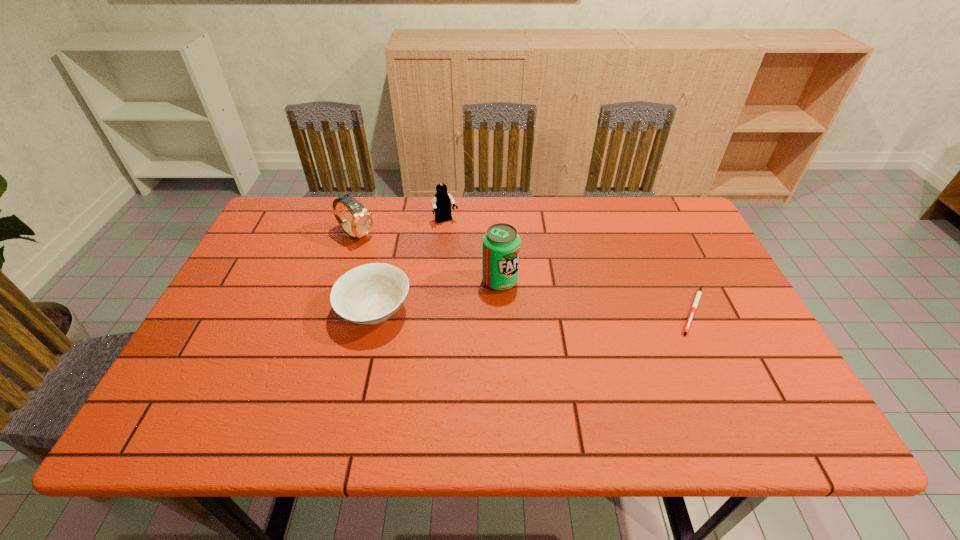
You are a GUI agent. You are given a task and a screenshot of the screen. Output one action in this format:
    pyautogui.click(x=<x>, y=<y>)
    Task: Click on the vacant space on the desktop that is between the bowl and the shortest object and is positioned on the front-facing side of the pop soda
    
    Given the screenshot: What is the action you would take?
    pyautogui.click(x=572, y=311)

The image size is (960, 540). What are the coordinates of `free space on the desktop that is between the bowl and the shortest object and is positioned on the front-facing side of the third object from right to left` in the screenshot? It's located at click(501, 311).

You are a GUI agent. You are given a task and a screenshot of the screen. Output one action in this format:
    pyautogui.click(x=<x>, y=<y>)
    Task: Click on the free space on the desktop that is between the fourth tallest object and the rightmost object and is positioned on the face of the watch
    
    Given the screenshot: What is the action you would take?
    point(488,311)